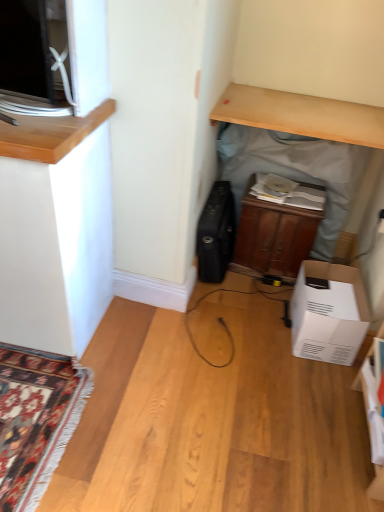
Question: From a real-world perspective, relative to white cardboard box at lower right, is light wood desk at upper center vertically above or below?

Choices:
 (A) below
 (B) above

Answer: (B)

Question: Is light wood desk at upper center inside or outside of white cardboard box at lower right?

Choices:
 (A) inside
 (B) outside

Answer: (B)

Question: Considering the real-world distances, which object is farthest from the white cardboard box at lower right?

Choices:
 (A) wooden cabinet at center
 (B) light wood desk at upper center
 (C) wooden cabinet at center
 (D) black matte suitcase at center

Answer: (B)

Question: Based on their relative distances, which object is nearer to the light wood desk at upper center?

Choices:
 (A) wooden cabinet at center
 (B) white cardboard box at lower right
 (C) black matte suitcase at center
 (D) wooden cabinet at center

Answer: (D)